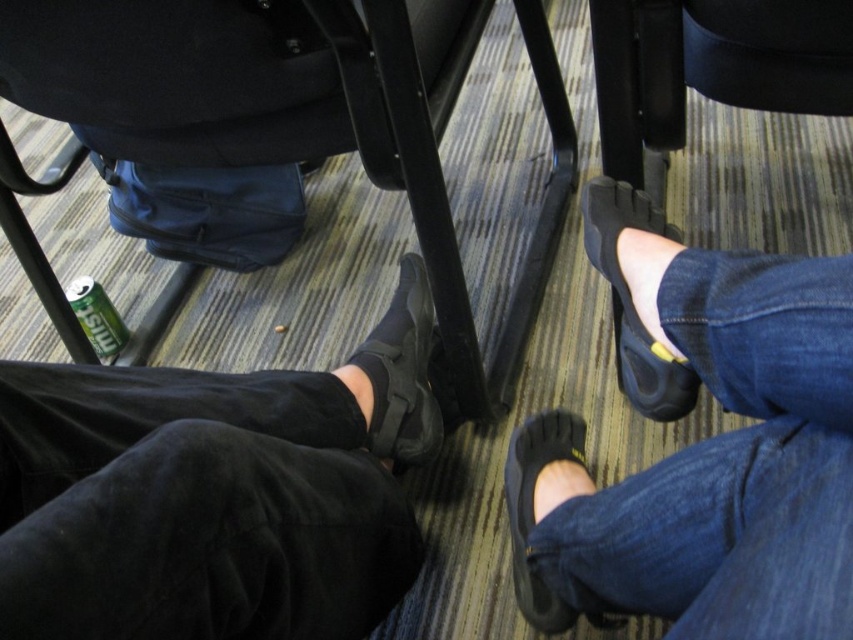
Based on the photo, you are a cleaning robot with a width of 20 centimeters. You need to move from the black suede shoes at lower left to the black suede shoes at lower right. Can you fit through the space between them?

The distance between the black suede shoes at lower left and black suede shoes at lower right is 25.86 centimeters. Since the robot is 20 centimeters wide, it can fit through the space between them as the distance is greater than the robot width.

You are a person sitting in the room and want to reach the black suede shoe at lower right from your current position. Is the black plastic chair at lower left in your way?

The black plastic chair at lower left is much taller than the black suede shoe at lower right, so yes, the chair is in your way.

You are organizing a shoe storage area in the conference room. You have two pairs of black suede shoes at lower left and black suede shoes at lower right. Which pair requires a wider storage space?

The black suede shoes at lower left require a wider storage space because their width is larger than the black suede shoes at lower right.